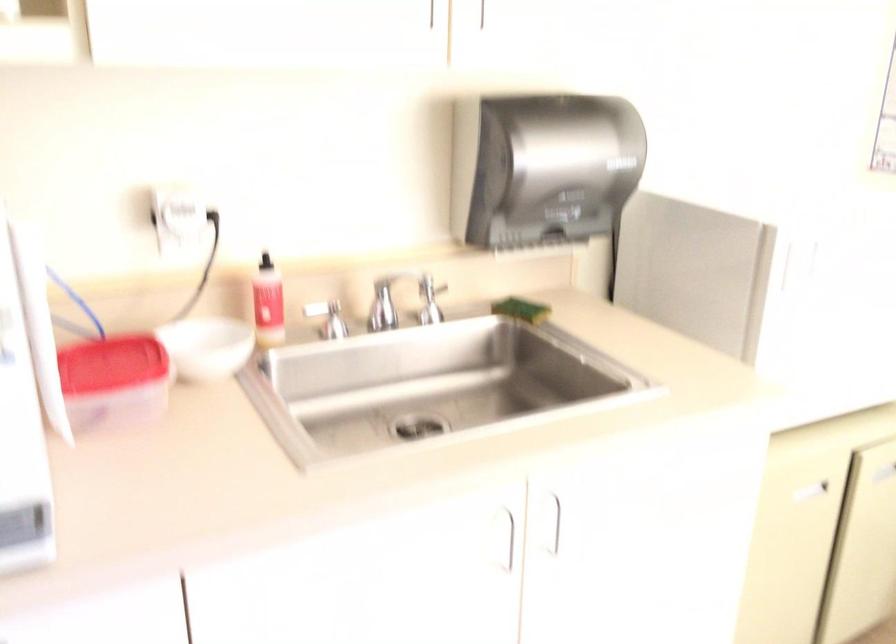
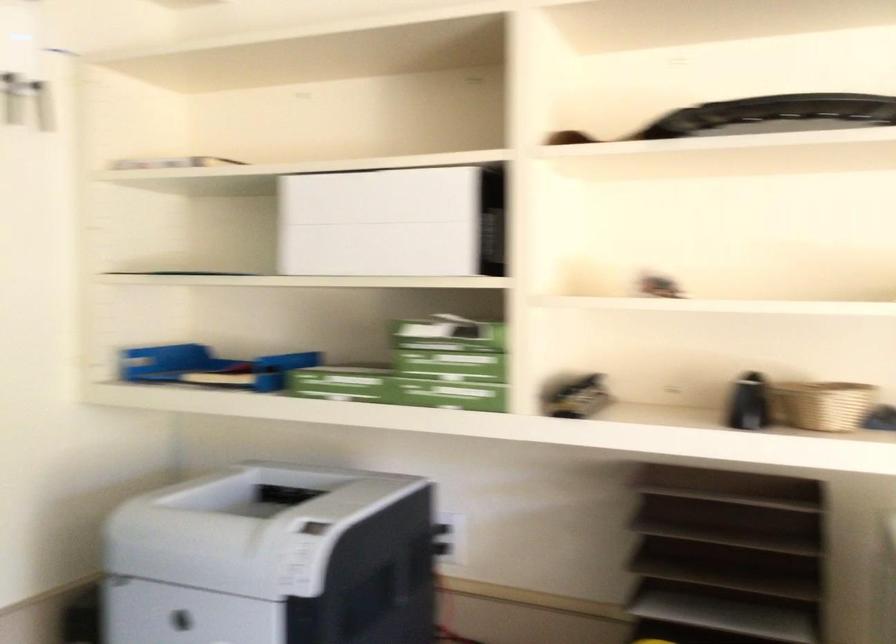
Question: The images are taken continuously from a first-person perspective. In which direction is your viewpoint rotating?

Choices:
 (A) Left
 (B) Right
 (C) Up
 (D) Down

Answer: (A)